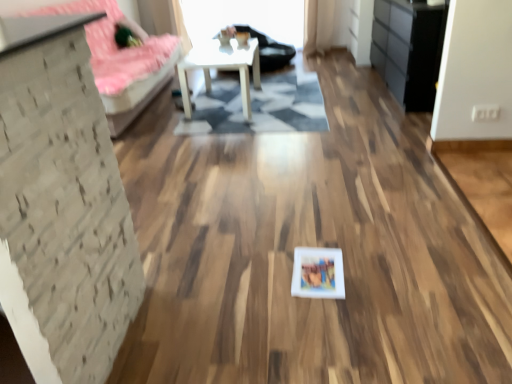
Locate an element on the screen. This screenshot has height=384, width=512. vacant area in front of matte white picture frame at center is located at coordinates (327, 314).